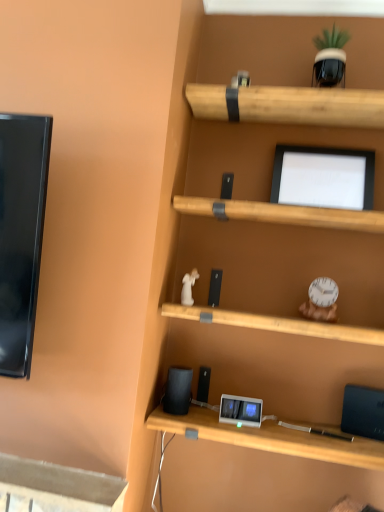
Question: From the image's perspective, is black matte computer monitor at upper center beneath black matte speaker at lower center?

Choices:
 (A) no
 (B) yes

Answer: (A)

Question: Considering the relative sizes of black matte computer monitor at upper center and black matte speaker at lower center in the image provided, is black matte computer monitor at upper center shorter than black matte speaker at lower center?

Choices:
 (A) yes
 (B) no

Answer: (B)

Question: Is black matte computer monitor at upper center touching black matte speaker at lower center?

Choices:
 (A) yes
 (B) no

Answer: (B)

Question: Is black matte computer monitor at upper center completely or partially outside of black matte speaker at lower center?

Choices:
 (A) yes
 (B) no

Answer: (A)

Question: Can you confirm if black matte computer monitor at upper center is positioned to the left of black matte speaker at lower center?

Choices:
 (A) yes
 (B) no

Answer: (B)

Question: From the image's perspective, is black matte computer monitor at upper center located above black matte speaker at lower center?

Choices:
 (A) yes
 (B) no

Answer: (A)

Question: Is black matte speaker at lower center in contact with black matte computer monitor at upper center?

Choices:
 (A) yes
 (B) no

Answer: (B)

Question: Considering the relative sizes of black matte speaker at lower center and black matte computer monitor at upper center in the image provided, is black matte speaker at lower center bigger than black matte computer monitor at upper center?

Choices:
 (A) yes
 (B) no

Answer: (B)

Question: Is black matte speaker at lower center positioned in front of black matte computer monitor at upper center?

Choices:
 (A) no
 (B) yes

Answer: (B)

Question: Can you confirm if black matte speaker at lower center is thinner than black matte computer monitor at upper center?

Choices:
 (A) no
 (B) yes

Answer: (B)

Question: Is black matte speaker at lower center shorter than black matte computer monitor at upper center?

Choices:
 (A) yes
 (B) no

Answer: (A)

Question: Considering the relative sizes of black matte speaker at lower center and black matte computer monitor at upper center in the image provided, is black matte speaker at lower center taller than black matte computer monitor at upper center?

Choices:
 (A) no
 (B) yes

Answer: (A)

Question: Looking at their shapes, would you say black matte speaker at lower center is wider or thinner than black matte computer monitor at upper center?

Choices:
 (A) thin
 (B) wide

Answer: (A)